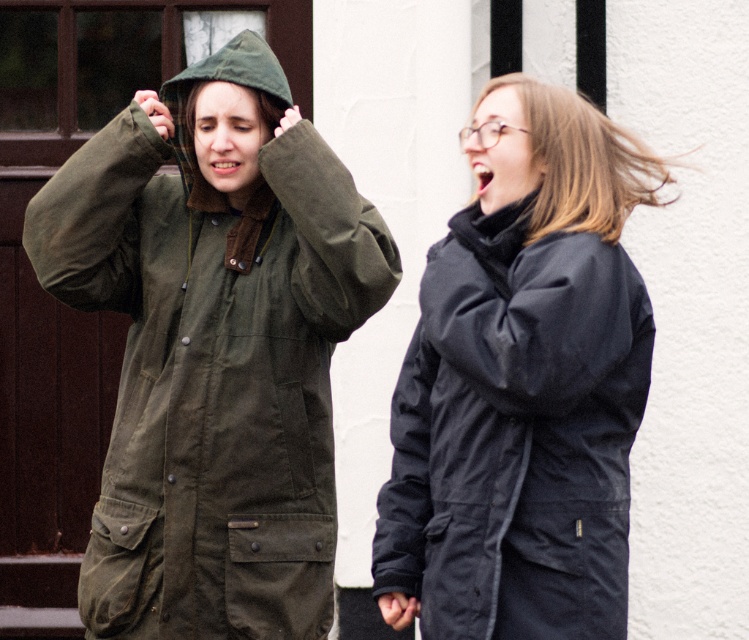
Who is more forward, (321, 627) or (554, 116)?

Positioned in front is point (554, 116).

Does point (200, 193) come farther from viewer compared to point (485, 104)?

Yes, it is.

Find the location of a particular element. olive green waxed canvas trench coat at left is located at coordinates (213, 348).